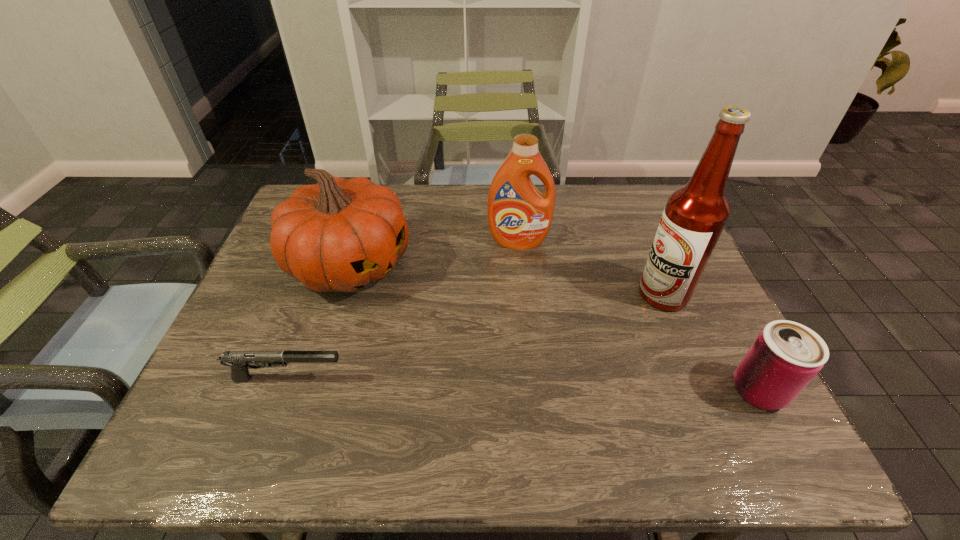
The width and height of the screenshot is (960, 540). What are the coordinates of `the shortest object` in the screenshot? It's located at (239, 361).

At what (x,y) coordinates should I click in order to perform the action: click on the fourth tallest object. Please return your answer as a coordinate pair (x, y). Looking at the image, I should click on (785, 356).

This screenshot has width=960, height=540. What are the coordinates of `pumpkin` in the screenshot? It's located at (340, 234).

At what (x,y) coordinates should I click in order to perform the action: click on the tallest object. Please return your answer as a coordinate pair (x, y). This screenshot has width=960, height=540. Looking at the image, I should click on (695, 215).

Image resolution: width=960 pixels, height=540 pixels. In order to click on the third object from right to left in this screenshot , I will do [x=519, y=216].

Find the location of a particular element. This screenshot has height=540, width=960. detergent is located at coordinates (519, 216).

The height and width of the screenshot is (540, 960). Find the location of `vacant region located at the muzzle end of the gun`. vacant region located at the muzzle end of the gun is located at coordinates (516, 379).

Locate an element on the screen. The height and width of the screenshot is (540, 960). vacant space situated on the left of the can is located at coordinates (562, 390).

The width and height of the screenshot is (960, 540). I want to click on blank space located 0.210m on the face of the pumpkin, so 459,328.

At what (x,y) coordinates should I click in order to perform the action: click on vacant space positioned on the face of the pumpkin. Please return your answer as a coordinate pair (x, y). Looking at the image, I should click on (519, 364).